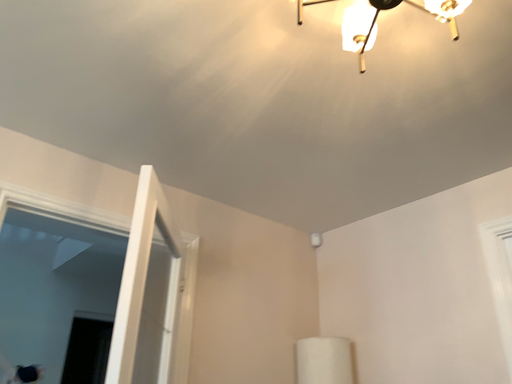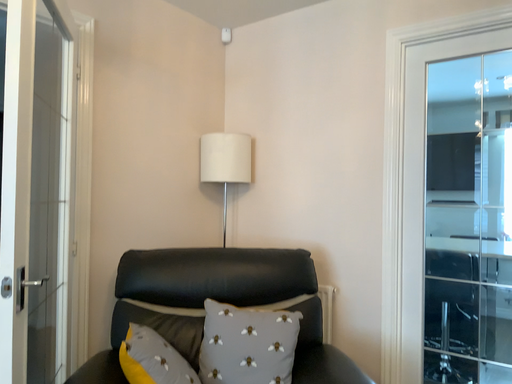
Question: How did the camera likely rotate when shooting the video?

Choices:
 (A) rotated downward
 (B) rotated upward

Answer: (A)